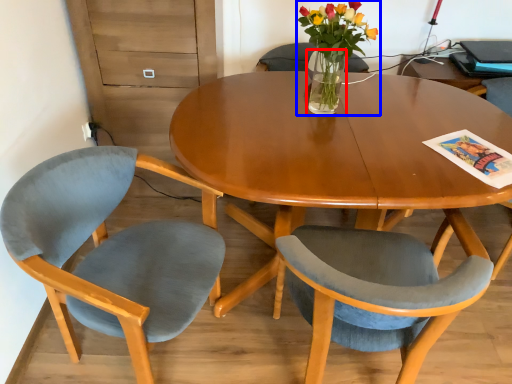
Question: Which object is further to the camera taking this photo, vase (highlighted by a red box) or houseplant (highlighted by a blue box)?

Choices:
 (A) vase
 (B) houseplant

Answer: (A)